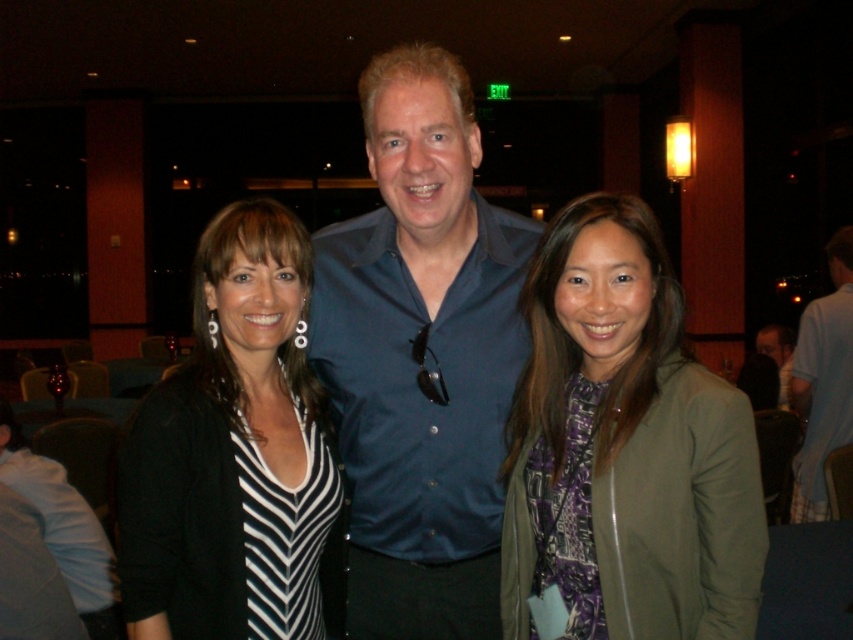
Does black and white striped shirt at center appear over blue shirt at center?

Correct, black and white striped shirt at center is located above blue shirt at center.

Who is taller, black and white striped shirt at center or blue shirt at center?

Standing taller between the two is blue shirt at center.

What do you see at coordinates (234, 456) in the screenshot? I see `black and white striped shirt at center` at bounding box center [234, 456].

Where is `black and white striped shirt at center`? This screenshot has width=853, height=640. black and white striped shirt at center is located at coordinates (234, 456).

Between green matte jacket at center and blue shirt at center, which one has more height?

blue shirt at center is taller.

Where is `green matte jacket at center`? This screenshot has width=853, height=640. green matte jacket at center is located at coordinates (625, 448).

At what (x,y) coordinates should I click in order to perform the action: click on green matte jacket at center. Please return your answer as a coordinate pair (x, y). The height and width of the screenshot is (640, 853). Looking at the image, I should click on (625, 448).

Is point (381, 109) farther from viewer compared to point (216, 356)?

Yes, it is.

Is blue button-down shirt at center to the left of black and white striped shirt at center from the viewer's perspective?

In fact, blue button-down shirt at center is to the right of black and white striped shirt at center.

Between point (428, 68) and point (219, 330), which one is positioned behind?

Point (219, 330)

In order to click on blue button-down shirt at center in this screenshot , I will do `click(421, 356)`.